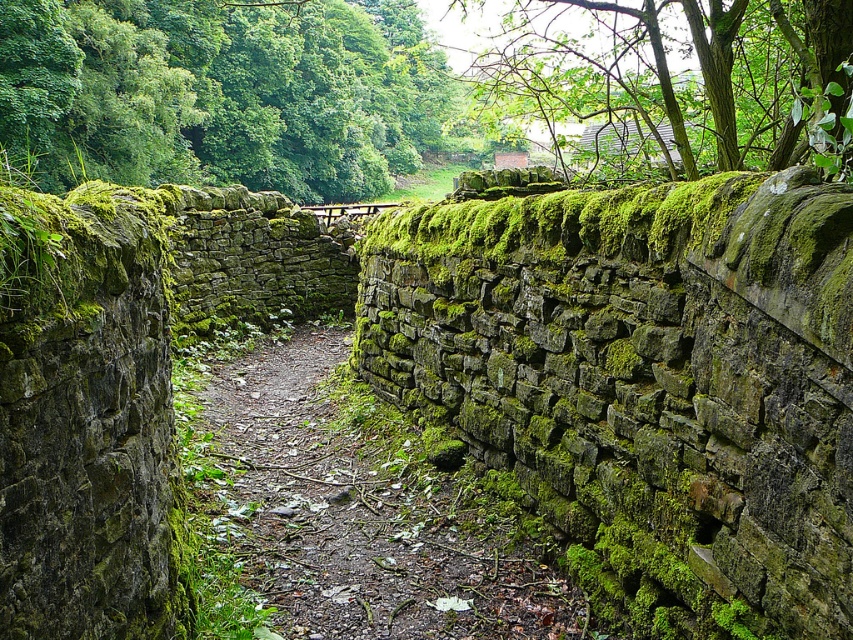
From the picture: You are a hiker standing at the start of the pathway and notice two green mossy structures ahead. One is labeled as the green mossy stone at upper center and the other as the green mossy stone wall at upper center. Which of these two is taller?

The green mossy stone at upper center is taller than the green mossy stone wall at upper center according to the description.

You are a hiker standing at the start of the pathway and see the green leafy tree at upper left and the green mossy stone wall at upper center. Which object is located more to the left side of the pathway?

The green leafy tree at upper left is positioned on the left side of the green mossy stone wall at upper center, so it is more to the left side of the pathway.

You are standing on the pathway between the two ancient stone walls and see two points marked on the ground ahead of you. The first point is at coordinates point (x=599, y=225) and the second point is at coordinates point (x=672, y=220). Which point is closer to your current position?

Point (x=672, y=220) is closer to your current position because it is nearer to the camera compared to point (x=599, y=225), which is further away.